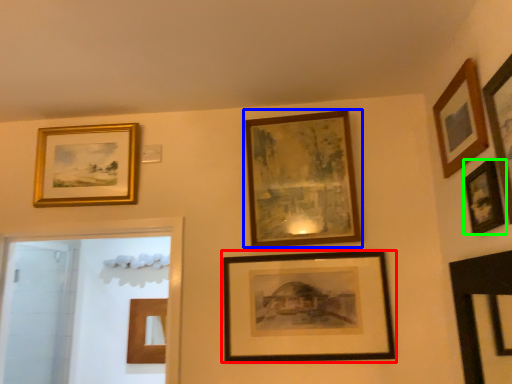
Question: Which object is the farthest from picture frame (highlighted by a red box)? Choose among these: picture frame (highlighted by a blue box) or picture frame (highlighted by a green box).

Choices:
 (A) picture frame
 (B) picture frame

Answer: (B)